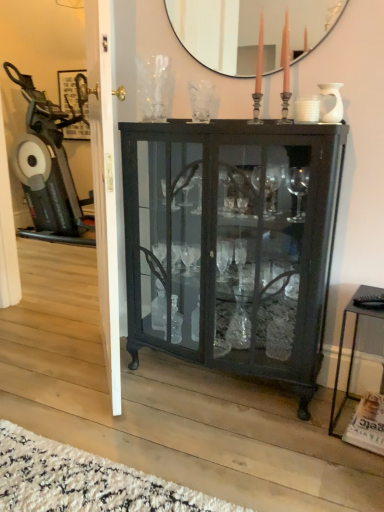
The width and height of the screenshot is (384, 512). I want to click on free space to the left of black metal side table at lower right, so click(x=301, y=424).